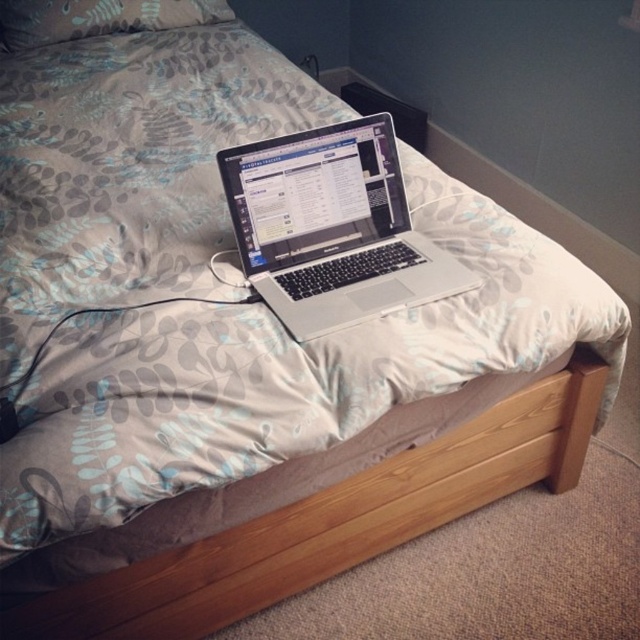
You are standing in the room and want to place a new decorative item on the bed. The bed is 1.5 meters wide. The silver metallic laptop at center is currently placed at coordinates 0.355, 0.519. If you want to place the new item 0.2 meters to the right of the laptop, will it still be on the bed?

The silver metallic laptop at center is at position (332, 227). Adding 0.2 meters to the right would place the new item at (332, 355). Since the bed is 1.5 meters wide, this position is still within the bed, so yes, it will be on the bed.

In the scene shown: You are standing in the room and want to place a small decorative item on the closest object between the wooden bed frame at lower center and the gray fabric pillow at upper center. Which object should you choose?

The wooden bed frame at lower center is closer to the viewer than the gray fabric pillow at upper center, so you should place the decorative item on the wooden bed frame at lower center.

In the scene shown: You are a delivery robot that needs to place a small package on the bed without touching the silver metallic laptop at center. The package is 0.5 meters long. Can you fit the package on the bed while keeping it at least 0.5 meters away from the laptop?

The silver metallic laptop at center is 1.08 meters away from the camera. Since the package is 0.5 meters long and needs to be placed at least 0.5 meters away from the laptop, there is sufficient space on the bed to accommodate the package without touching the laptop.